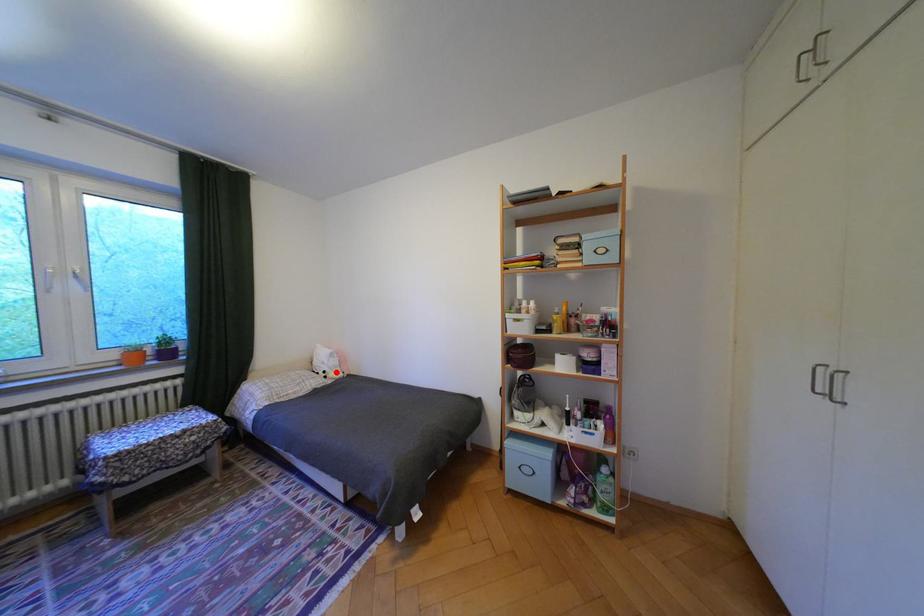
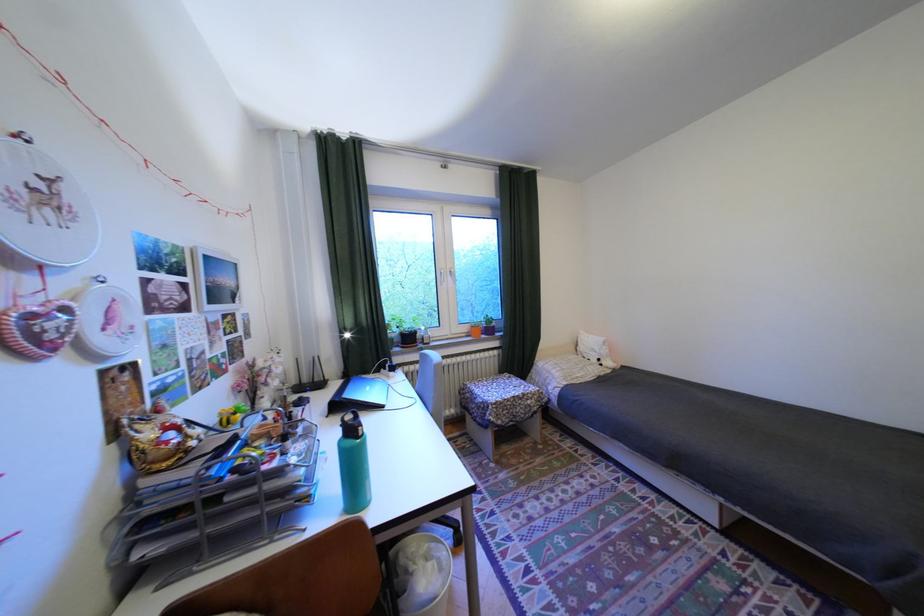
Question: I am providing you with two images of the same scene from different viewpoints. In image1, a red point is highlighted. Considering the same 3D point in image2, which of the following is correct?

Choices:
 (A) It is closer
 (B) It is farther

Answer: (B)